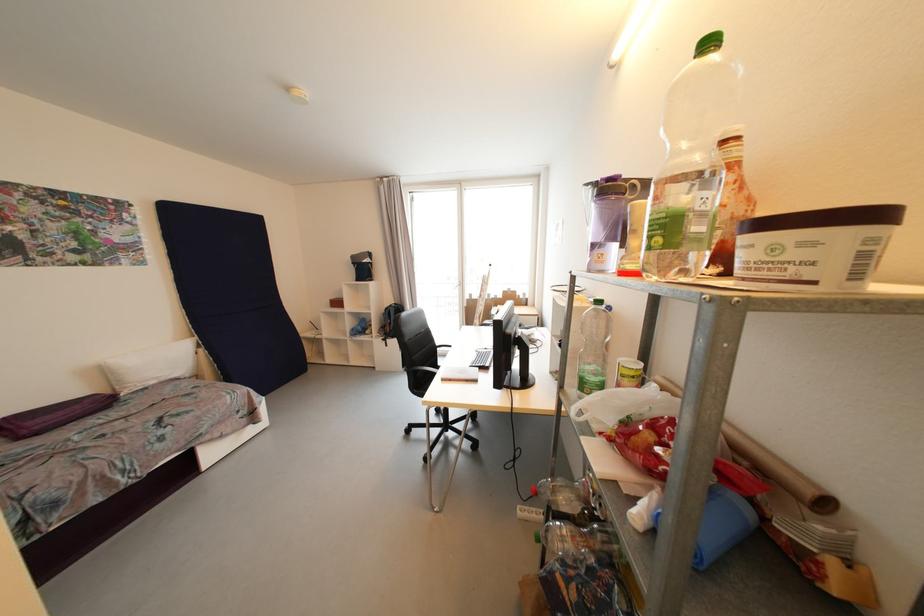
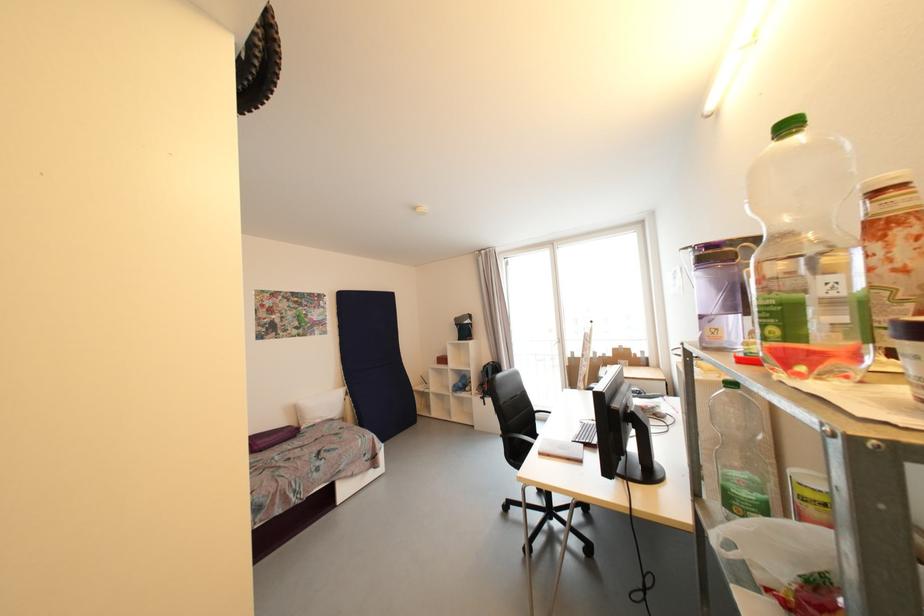
Where in the second image is the point corresponding to the point at 614,424 from the first image?

(784, 575)